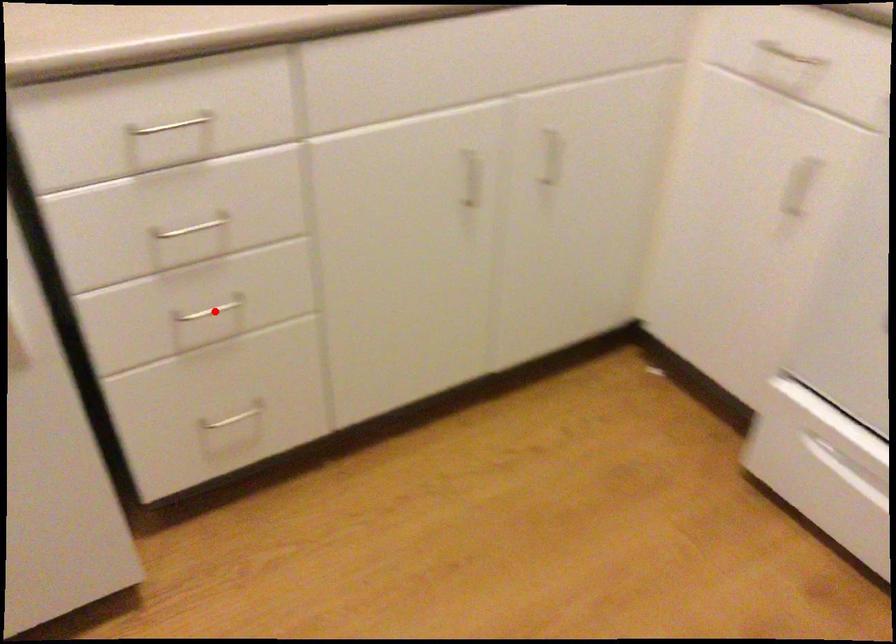
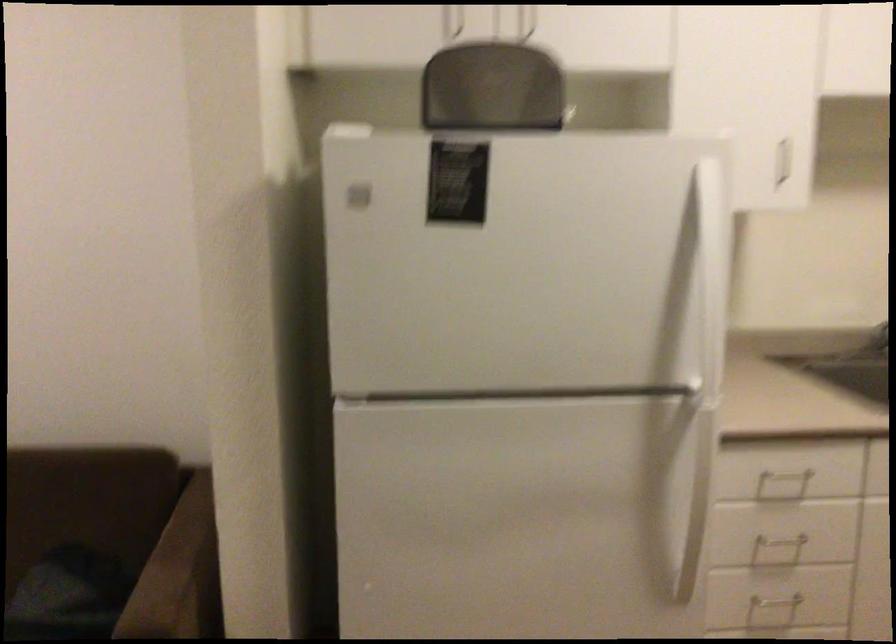
Where in the second image is the point corresponding to the highlighted location from the first image?

(773, 608)